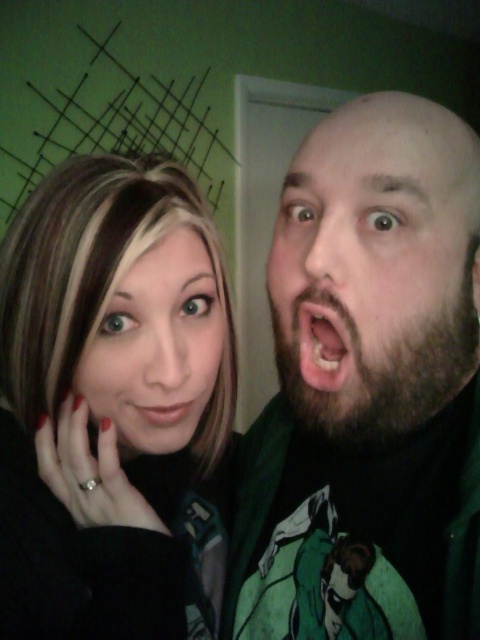
Locate an element on the screen. matte skin face at left is located at coordinates (156, 348).

Find the location of a particular element. Image resolution: width=480 pixels, height=640 pixels. matte skin face at left is located at coordinates (156, 348).

Locate an element on the screen. matte skin face at left is located at coordinates (156, 348).

Is bearded face at right shorter than matte skin face at left?

Incorrect, bearded face at right's height does not fall short of matte skin face at left's.

Does bearded face at right lie in front of matte skin face at left?

Yes.

Is point (416, 266) positioned before point (213, 369)?

That is True.

Locate an element on the screen. bearded face at right is located at coordinates (376, 268).

Which is below, dark brown beard at right or beige matte skin at center?

dark brown beard at right is lower down.

At what (x,y) coordinates should I click in order to perform the action: click on dark brown beard at right. Please return your answer as a coordinate pair (x, y). The width and height of the screenshot is (480, 640). Looking at the image, I should click on tap(370, 392).